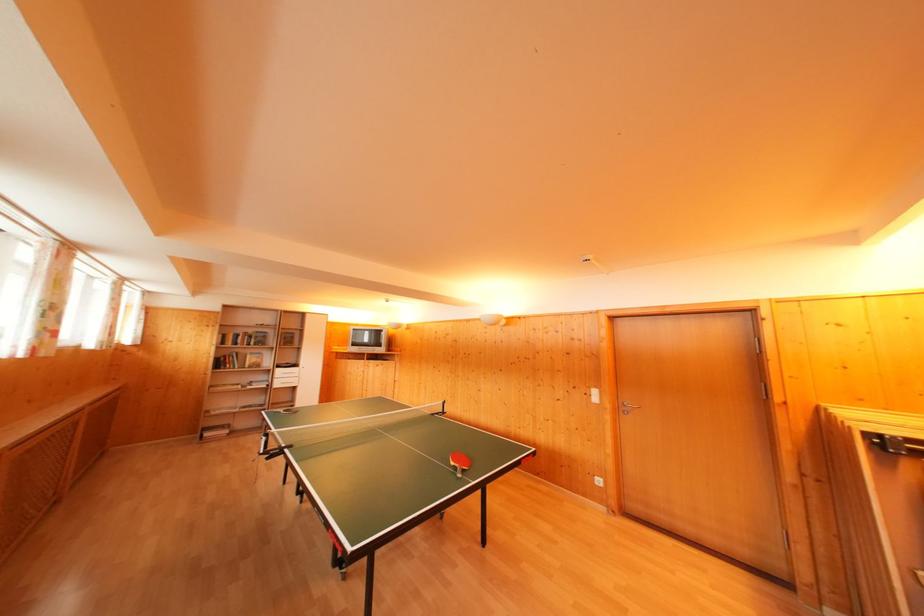
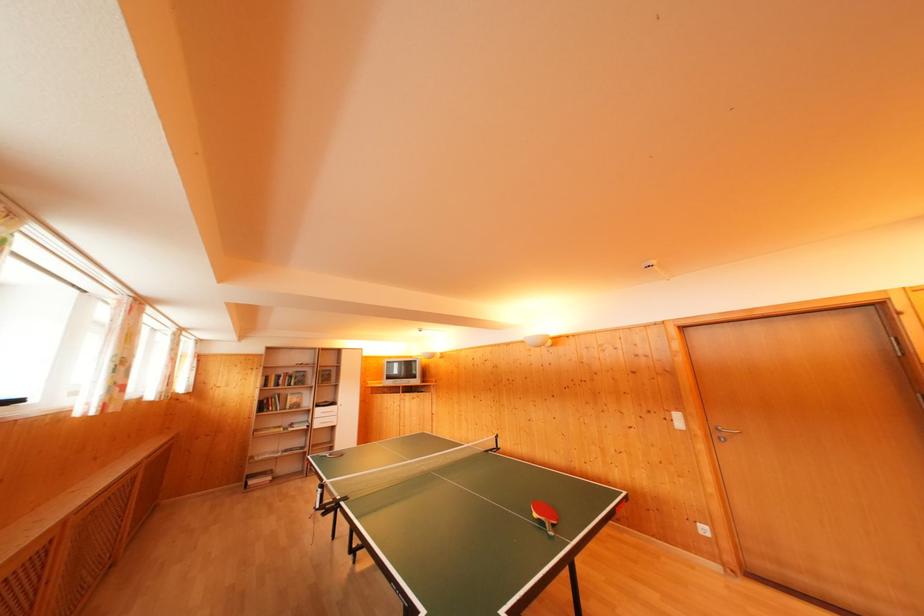
Question: The first image is from the beginning of the video and the second image is from the end. How did the camera likely rotate when shooting the video?

Choices:
 (A) Left
 (B) Right
 (C) Up
 (D) Down

Answer: (C)